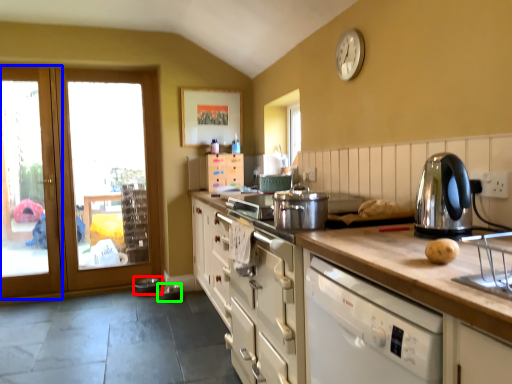
Question: Which is nearer to the appliance (highlighted by a red box)? screen door (highlighted by a blue box) or appliance (highlighted by a green box).

Choices:
 (A) screen door
 (B) appliance

Answer: (B)